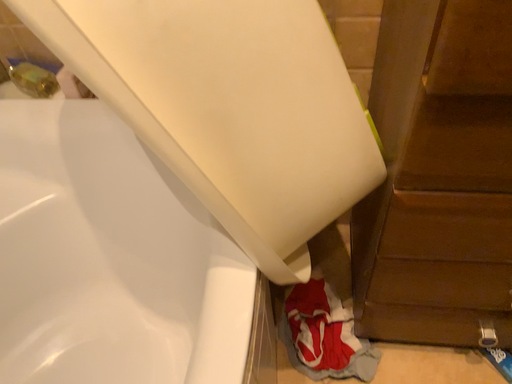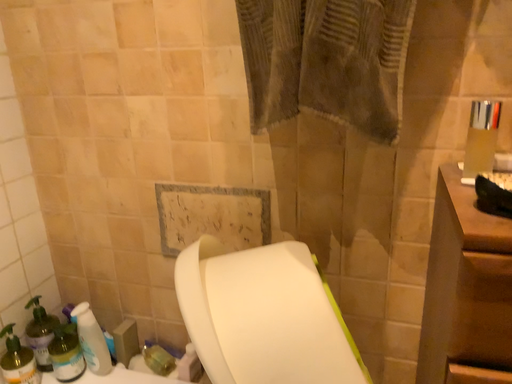
Question: Which way did the camera rotate in the video?

Choices:
 (A) rotated downward
 (B) rotated upward

Answer: (B)